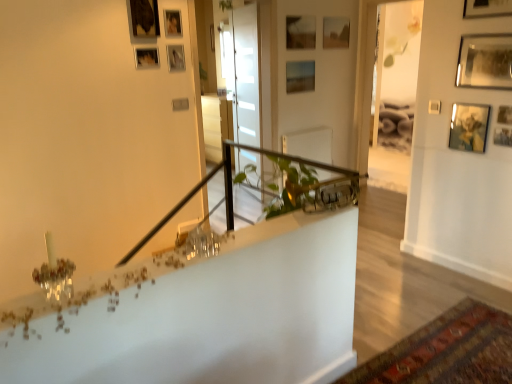
I want to click on vacant area situated below carpeted mat at lower right (from a real-world perspective), so point(435,362).